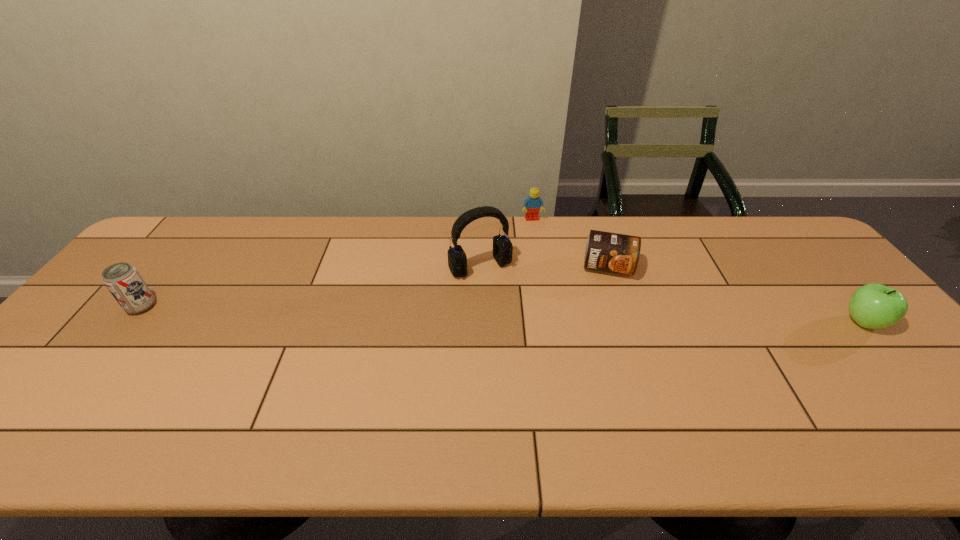
The width and height of the screenshot is (960, 540). Find the location of `free spot between the can and the beer can`. free spot between the can and the beer can is located at coordinates (374, 287).

Locate an element on the screen. free space that is in between the rightmost object and the leftmost object is located at coordinates (503, 314).

Locate an element on the screen. The image size is (960, 540). free space between the leftmost object and the rightmost object is located at coordinates (503, 314).

Where is `empty location between the headset and the can`? Image resolution: width=960 pixels, height=540 pixels. empty location between the headset and the can is located at coordinates (544, 267).

Where is `free space between the third object from right to left and the leftmost object`? free space between the third object from right to left and the leftmost object is located at coordinates (337, 263).

I want to click on free spot between the beer can and the fourth object from left to right, so click(374, 287).

At what (x,y) coordinates should I click in order to perform the action: click on vacant space that's between the rightmost object and the fourth object from right to left. Please return your answer as a coordinate pair (x, y). Image resolution: width=960 pixels, height=540 pixels. Looking at the image, I should click on (672, 294).

At what (x,y) coordinates should I click in order to perform the action: click on free spot between the headset and the rightmost object. Please return your answer as a coordinate pair (x, y). The width and height of the screenshot is (960, 540). Looking at the image, I should click on (672, 294).

This screenshot has height=540, width=960. Find the location of `unoccupied position between the third object from right to left and the leftmost object`. unoccupied position between the third object from right to left and the leftmost object is located at coordinates pos(337,263).

The width and height of the screenshot is (960, 540). I want to click on object that is the closest one to the apple, so click(x=606, y=251).